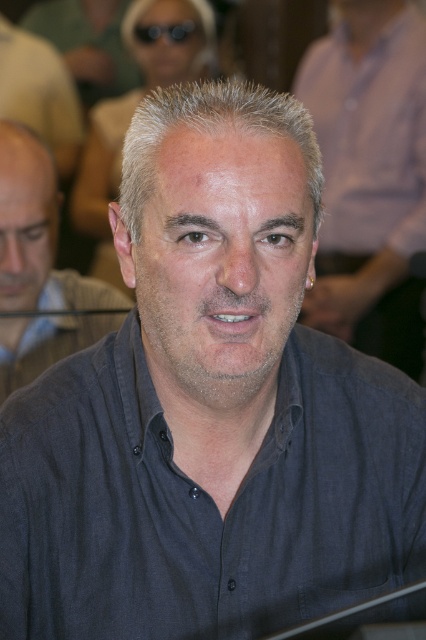
You are standing 10 feet away from the man in the image. A point at coordinates point (28, 104) is located on his face. Can you reach this point with your hand if you extend it fully?

The distance of point (28, 104) from viewer is 9.59 feet, which is less than 10 feet. So yes, you can reach the point with your hand if you extend it fully.

You are a photographer trying to adjust the focus of your camera. You want to ensure that both the matte gray shirt at left and the black plastic goggles at upper center are in focus. Given their positions, which object should you focus on first to achieve this?

You should focus on the black plastic goggles at upper center first because the matte gray shirt at left is located below it, meaning the goggles are closer to the camera. By focusing on the closer object, you can ensure both are in focus within the depth of field.